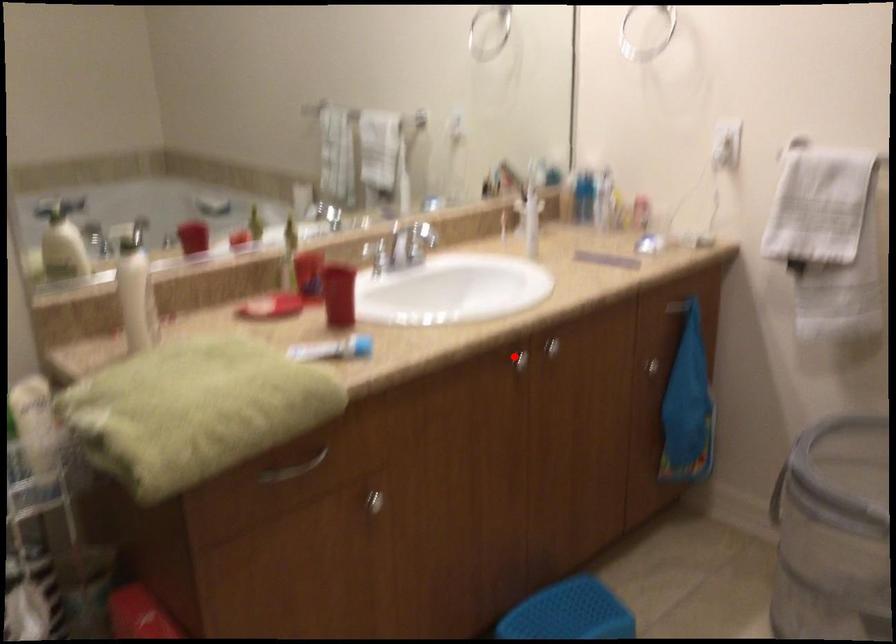
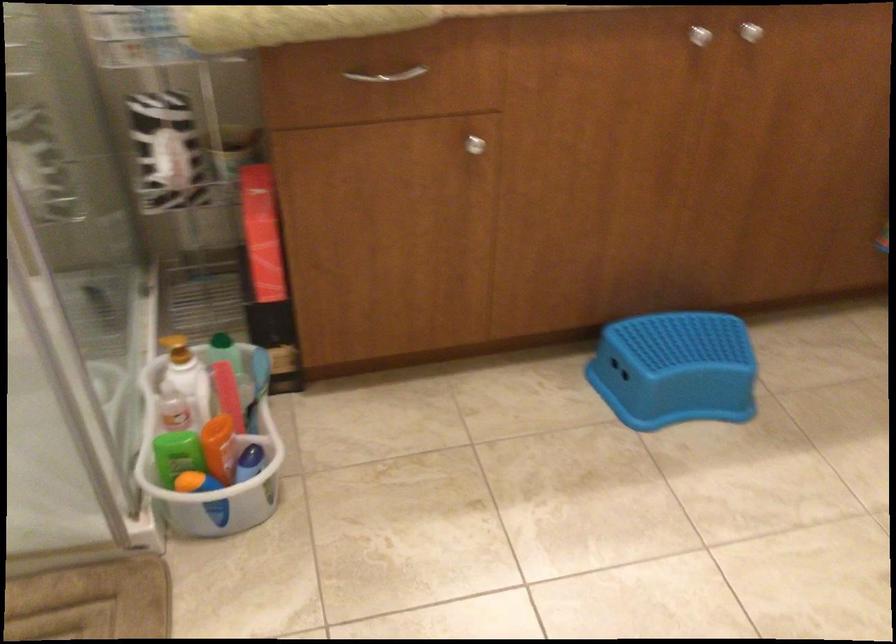
Question: A red point is marked in image1. In image2, is the corresponding 3D point closer to the camera or farther? Reply with the corresponding letter.

Choices:
 (A) The corresponding 3D point is closer.
 (B) The corresponding 3D point is farther.

Answer: (A)